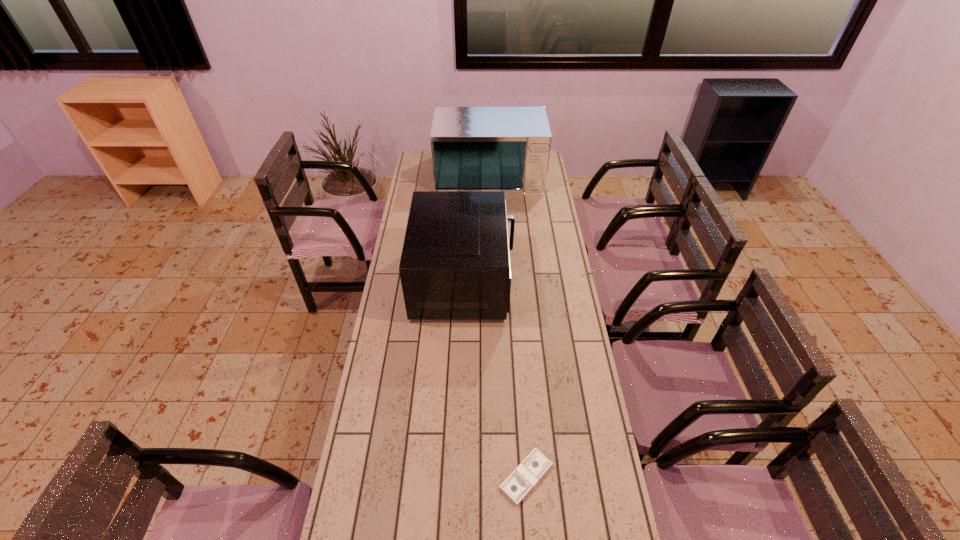
Locate an element on the screen. the farthest object is located at coordinates pyautogui.click(x=507, y=149).

Identify the location of the nearer microwave_oven. (455, 264).

Where is `the shortest object`? the shortest object is located at coordinates (522, 480).

The width and height of the screenshot is (960, 540). What are the coordinates of `dollar` in the screenshot? It's located at (522, 480).

I want to click on vacant space located 0.090m on the front-facing side of the farther microwave_oven, so click(x=491, y=204).

Where is `blank space located 0.170m on the front-facing side of the nearer microwave_oven`? This screenshot has width=960, height=540. blank space located 0.170m on the front-facing side of the nearer microwave_oven is located at coordinates (554, 280).

You are a GUI agent. You are given a task and a screenshot of the screen. Output one action in this format:
    pyautogui.click(x=<x>, y=<y>)
    Task: Click on the free spot located on the left of the shortest object
    
    Given the screenshot: What is the action you would take?
    pyautogui.click(x=438, y=477)

Image resolution: width=960 pixels, height=540 pixels. Identify the location of object that is at the far edge. (507, 149).

At what (x,y) coordinates should I click in order to perform the action: click on microwave oven positioned at the right edge. Please return your answer as a coordinate pair (x, y). Looking at the image, I should click on pos(507,149).

Identify the location of dollar positioned at the right edge. The height and width of the screenshot is (540, 960). (522, 480).